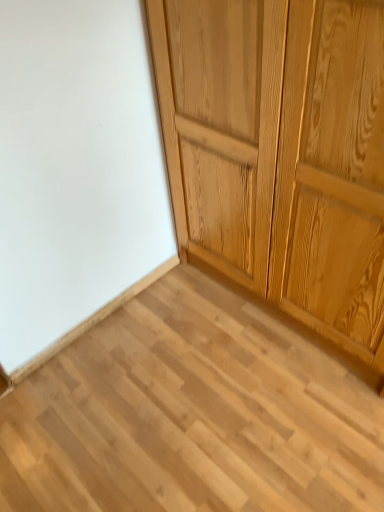
Question: Can you confirm if light wood plank at center is thinner than light brown wood cupboard at upper right?

Choices:
 (A) yes
 (B) no

Answer: (B)

Question: Considering the relative sizes of light wood plank at center and light brown wood cupboard at upper right in the image provided, is light wood plank at center smaller than light brown wood cupboard at upper right?

Choices:
 (A) no
 (B) yes

Answer: (B)

Question: Can light brown wood cupboard at upper right be found inside light wood plank at center?

Choices:
 (A) yes
 (B) no

Answer: (B)

Question: Is light wood plank at center wider than light brown wood cupboard at upper right?

Choices:
 (A) yes
 (B) no

Answer: (A)

Question: Is light wood plank at center in front of light brown wood cupboard at upper right?

Choices:
 (A) no
 (B) yes

Answer: (A)

Question: Can you confirm if light wood plank at center is shorter than light brown wood cupboard at upper right?

Choices:
 (A) yes
 (B) no

Answer: (A)

Question: Is light brown wood cupboard at upper right positioned far away from light wood plank at center?

Choices:
 (A) no
 (B) yes

Answer: (A)

Question: Is light brown wood cupboard at upper right positioned behind light wood plank at center?

Choices:
 (A) no
 (B) yes

Answer: (A)

Question: Is light brown wood cupboard at upper right positioned with its back to light wood plank at center?

Choices:
 (A) yes
 (B) no

Answer: (B)

Question: From a real-world perspective, is light brown wood cupboard at upper right over light wood plank at center?

Choices:
 (A) yes
 (B) no

Answer: (A)

Question: Considering the relative positions of light brown wood cupboard at upper right and light wood plank at center in the image provided, is light brown wood cupboard at upper right to the left of light wood plank at center from the viewer's perspective?

Choices:
 (A) yes
 (B) no

Answer: (B)

Question: From the image's perspective, would you say light brown wood cupboard at upper right is shown under light wood plank at center?

Choices:
 (A) no
 (B) yes

Answer: (A)

Question: Considering the positions of light wood plank at center and light brown wood cupboard at upper right in the image, is light wood plank at center wider or thinner than light brown wood cupboard at upper right?

Choices:
 (A) thin
 (B) wide

Answer: (B)